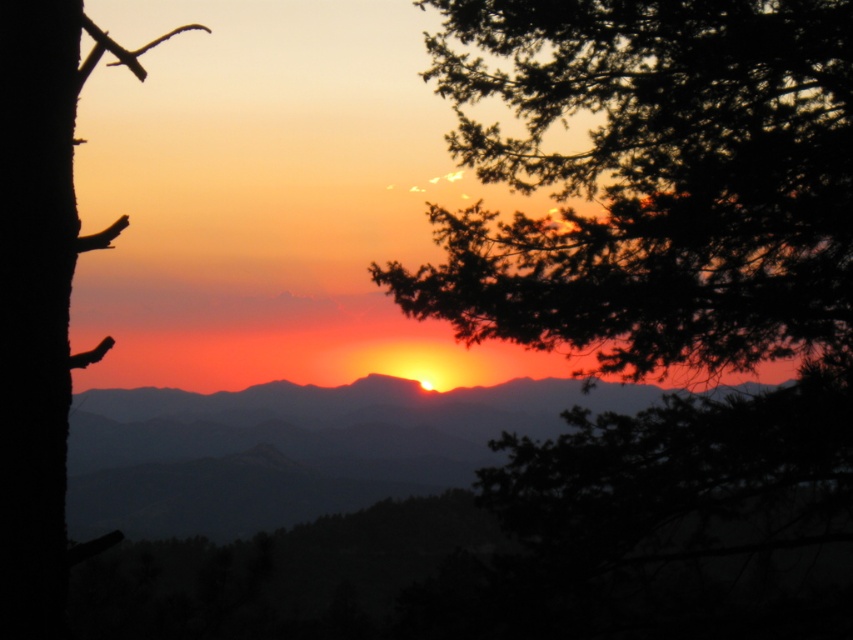
Question: Is silhouette pine branch at upper right positioned in front of silhouetted mountain at center?

Choices:
 (A) no
 (B) yes

Answer: (B)

Question: Which point is farther to the camera?

Choices:
 (A) (193, 392)
 (B) (0, 225)

Answer: (A)

Question: Which point appears farthest from the camera in this image?

Choices:
 (A) (0, 465)
 (B) (169, 442)
 (C) (769, 316)

Answer: (B)

Question: Among these objects, which one is farthest from the camera?

Choices:
 (A) silhouette pine branch at upper right
 (B) silky brown tree trunk at left

Answer: (A)

Question: Does silhouette pine branch at upper right appear over silky brown tree trunk at left?

Choices:
 (A) no
 (B) yes

Answer: (B)

Question: Can you confirm if silhouette pine branch at upper right is positioned to the left of silky brown tree trunk at left?

Choices:
 (A) no
 (B) yes

Answer: (A)